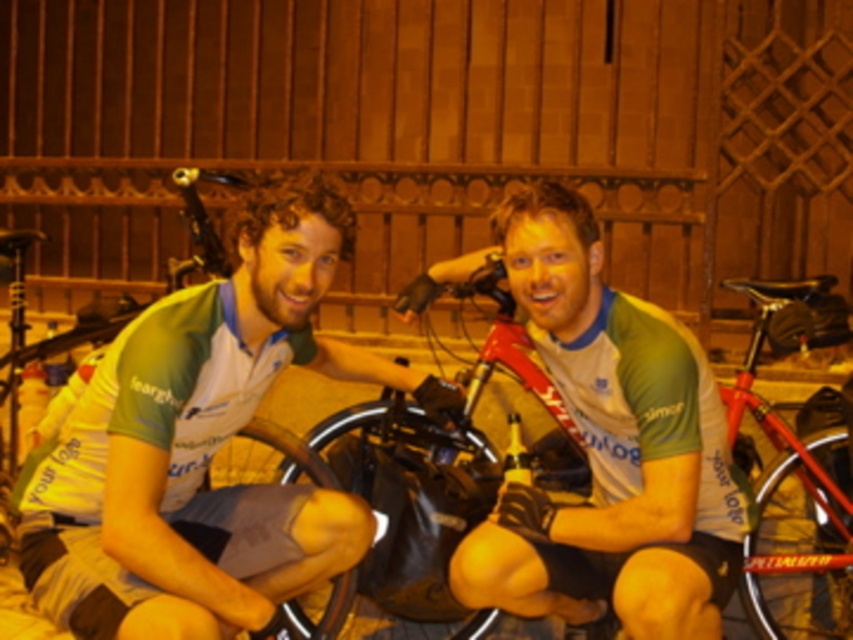
Who is positioned more to the right, green jersey at center or red matte bicycle at center?

red matte bicycle at center

Is point (146, 579) positioned behind point (339, 608)?

No.

Where is `green jersey at center`? Image resolution: width=853 pixels, height=640 pixels. green jersey at center is located at coordinates (202, 445).